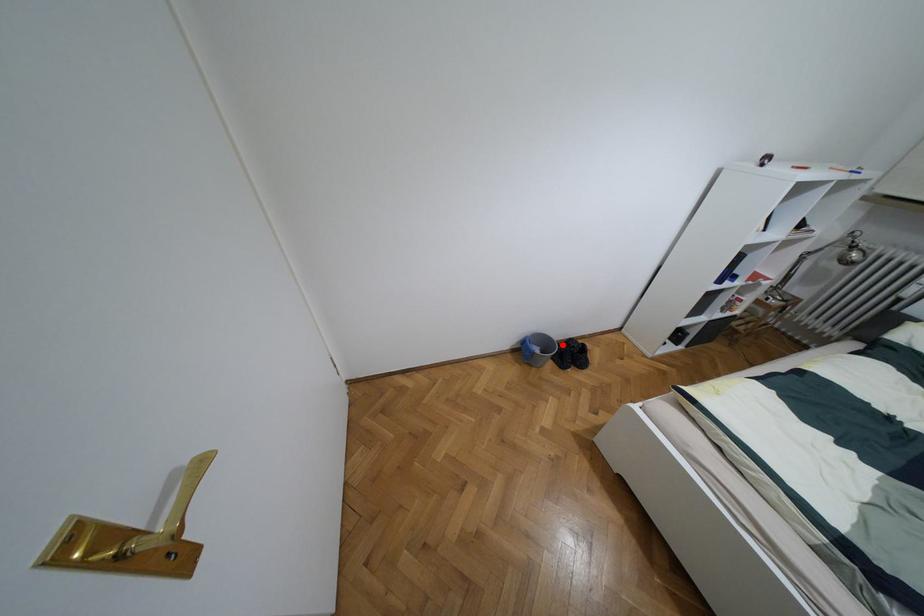
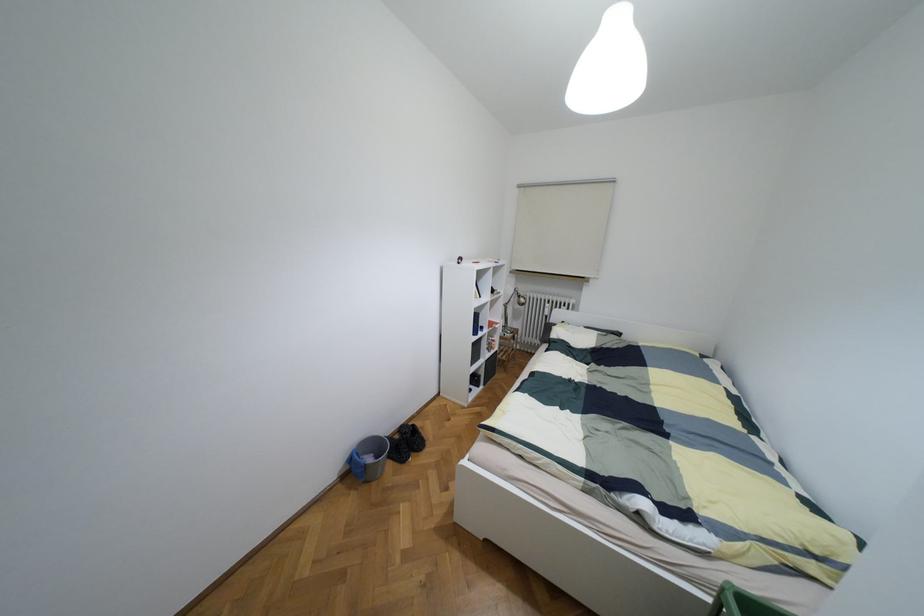
Question: A red point is marked in image1. In image2, is the corresponding 3D point closer to the camera or farther? Reply with the corresponding letter.

Choices:
 (A) The corresponding 3D point is closer.
 (B) The corresponding 3D point is farther.

Answer: (A)